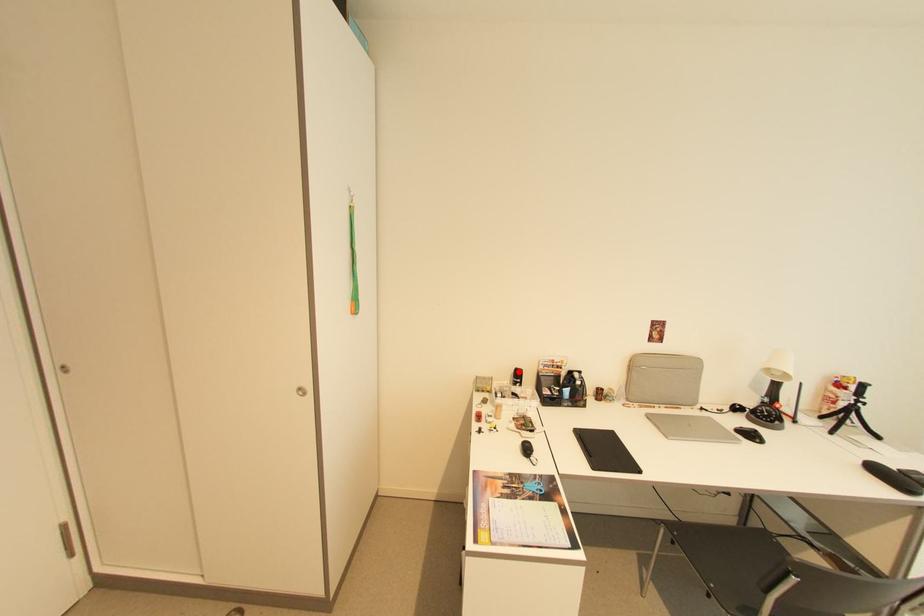
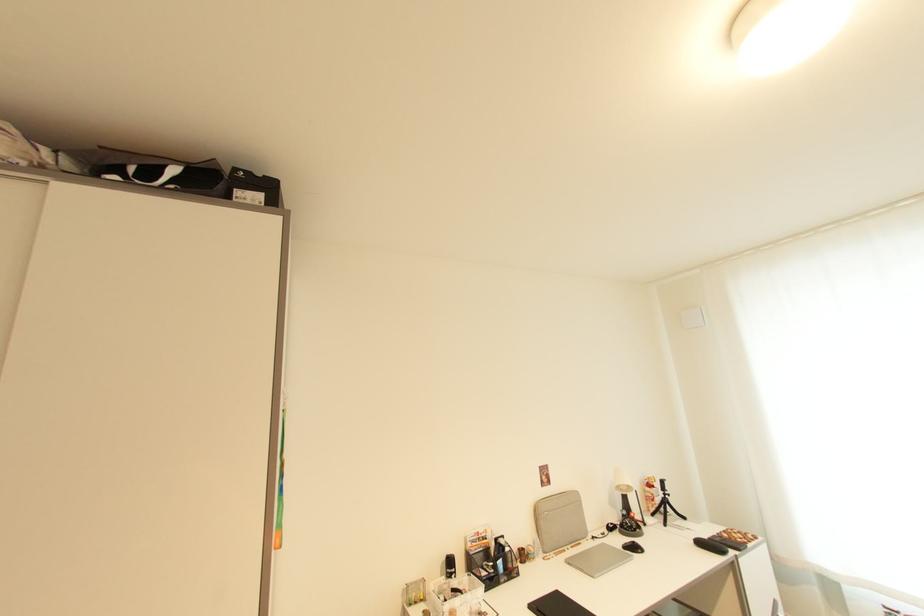
Find the pixel in the second image that matches the highlighted location in the first image.

(450, 561)